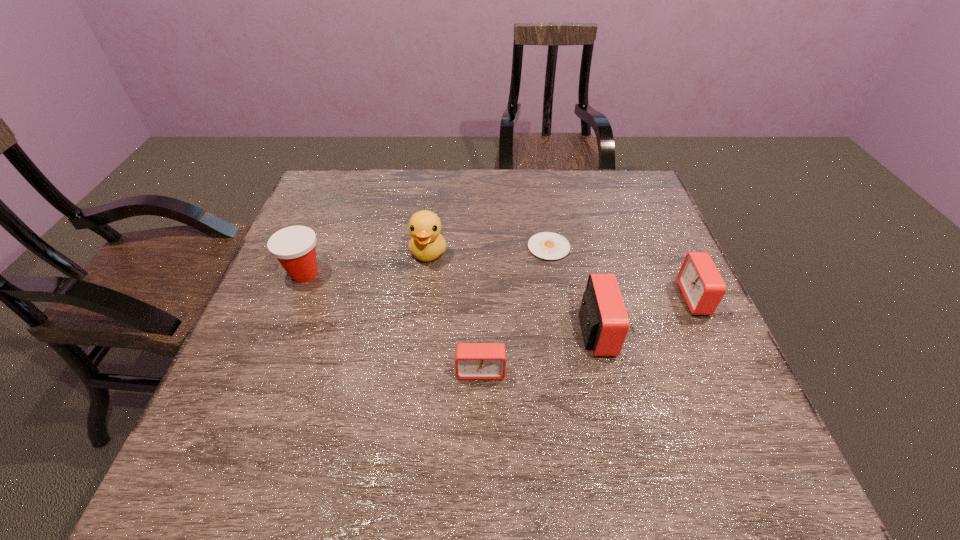
I want to click on free area in between the leftmost object and the second alarm clock from left to right, so click(450, 303).

Where is `free spot between the tallest alarm clock and the rightmost object`? This screenshot has height=540, width=960. free spot between the tallest alarm clock and the rightmost object is located at coordinates (645, 315).

Where is `free spot between the duck and the Dixie cup`? This screenshot has height=540, width=960. free spot between the duck and the Dixie cup is located at coordinates (367, 263).

Locate an element on the screen. This screenshot has width=960, height=540. vacant space that's between the second alarm clock from right to left and the egg yolk is located at coordinates (572, 289).

Identify the location of object that ranks as the closest to the second alarm clock from left to right. This screenshot has height=540, width=960. (546, 245).

Identify which object is the second nearest to the duck. Please provide its 2D coordinates. Your answer should be formatted as a tuple, i.e. [(x, y)], where the tuple contains the x and y coordinates of a point satisfying the conditions above.

[(546, 245)]

This screenshot has width=960, height=540. In order to click on alarm clock that is the third closest one to the leftmost object in this screenshot , I will do click(702, 286).

Identify which alarm clock is located as the nearest to the second tallest alarm clock. Please provide its 2D coordinates. Your answer should be formatted as a tuple, i.e. [(x, y)], where the tuple contains the x and y coordinates of a point satisfying the conditions above.

[(604, 321)]

At what (x,y) coordinates should I click in order to perform the action: click on vacant area that satisfies the following two spatial constraints: 1. on the front-facing side of the second alarm clock from left to right; 2. on the front-facing side of the leftmost alarm clock. Please return your answer as a coordinate pair (x, y). Looking at the image, I should click on (605, 372).

The image size is (960, 540). Find the location of `blank area in the image that satisfies the following two spatial constraints: 1. on the front-facing side of the second alarm clock from left to right; 2. on the front-facing side of the leftmost alarm clock`. blank area in the image that satisfies the following two spatial constraints: 1. on the front-facing side of the second alarm clock from left to right; 2. on the front-facing side of the leftmost alarm clock is located at coordinates (605, 372).